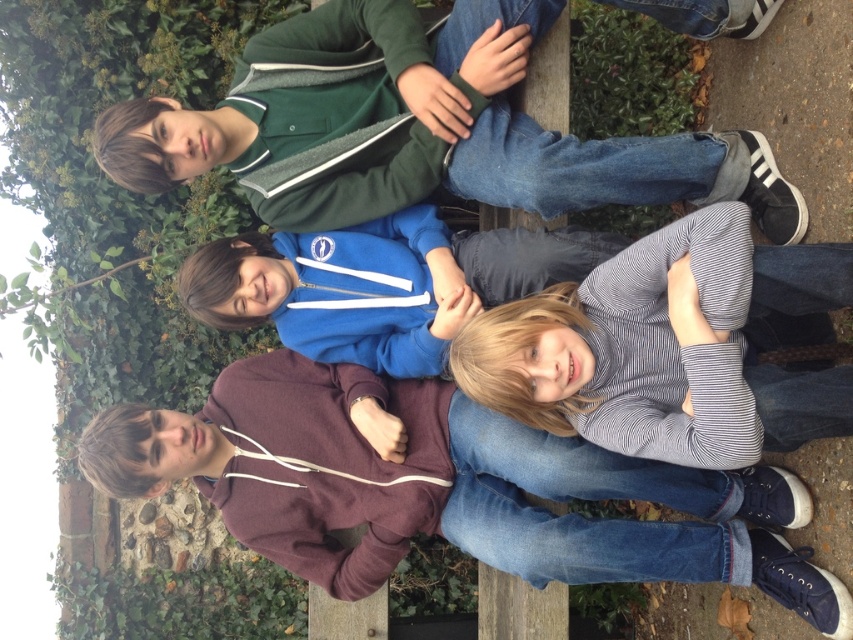
Question: Among these objects, which one is farthest from the camera?

Choices:
 (A) striped cotton shirt at lower right
 (B) blue fleece jacket at center

Answer: (B)

Question: Does green fleece jacket at upper center have a greater width compared to striped cotton shirt at lower right?

Choices:
 (A) no
 (B) yes

Answer: (B)

Question: Which object appears closest to the camera in this image?

Choices:
 (A) blue fleece jacket at center
 (B) striped cotton shirt at lower right

Answer: (B)

Question: Does green fleece jacket at upper center have a smaller size compared to blue fleece jacket at center?

Choices:
 (A) no
 (B) yes

Answer: (A)

Question: Which of the following is the farthest from the observer?

Choices:
 (A) striped cotton shirt at lower right
 (B) blue fleece jacket at center
 (C) green fleece jacket at upper center

Answer: (B)

Question: Can you confirm if green fleece jacket at upper center is bigger than blue fleece jacket at center?

Choices:
 (A) no
 (B) yes

Answer: (B)